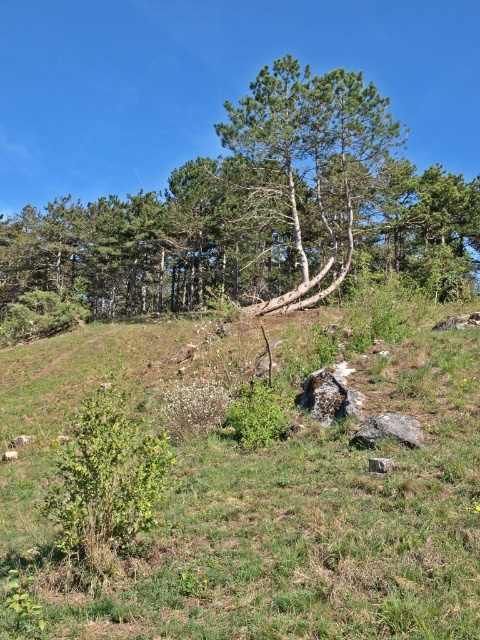
You are a hiker trying to navigate through the grassy slope. You see the gray rough rock at lower center and the gray rough stone at center. Which object is closer to your current position?

The gray rough rock at lower center is closer to your current position because it is in front of the gray rough stone at center.

You are standing at the bottom of the slope and want to place a small flag at the exact location of the gray rough rock at lower center. What are the coordinates where you should place the flag?

The coordinates for the gray rough rock at lower center are at point (388, 429).